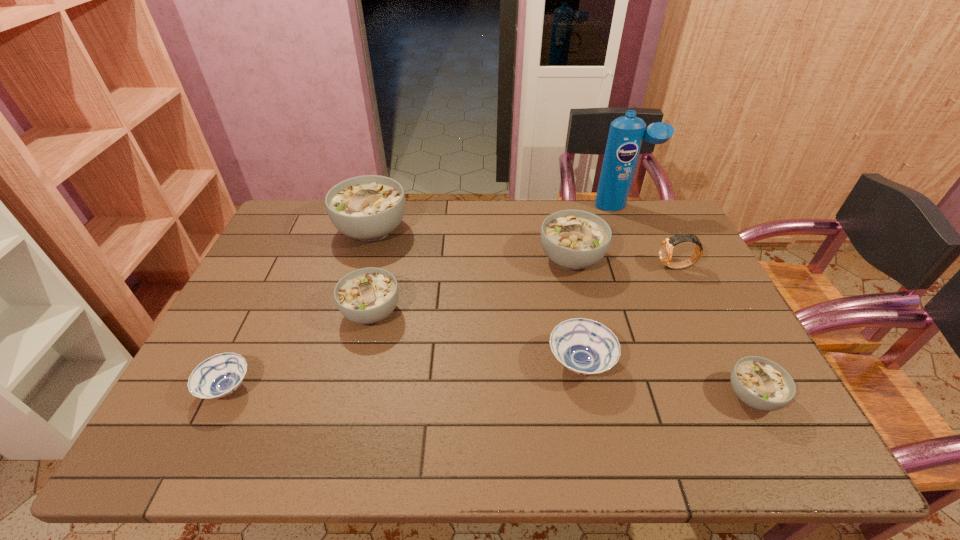
Where is `free region located 0.130m on the front of the bigger blue soup bowl`? free region located 0.130m on the front of the bigger blue soup bowl is located at coordinates (597, 446).

Find the location of a particular element. vacant region located on the back of the nearest white soup bowl is located at coordinates pyautogui.click(x=706, y=305).

The image size is (960, 540). In order to click on vacant space positioned on the back of the smaller blue soup bowl in this screenshot , I will do `click(278, 283)`.

Find the location of a particular element. shampoo that is at the far edge is located at coordinates (626, 133).

The image size is (960, 540). Identify the location of object located at the left edge. (220, 375).

Find the location of a particular element. Image resolution: width=960 pixels, height=540 pixels. shampoo located in the right edge section of the desktop is located at coordinates (626, 133).

You are a GUI agent. You are given a task and a screenshot of the screen. Output one action in this format:
    pyautogui.click(x=<x>, y=<y>)
    Task: Click on the watch at the right edge
    This screenshot has height=540, width=960.
    Given the screenshot: What is the action you would take?
    pyautogui.click(x=666, y=247)

Find the location of a particular element. Image resolution: width=960 pixels, height=540 pixels. soup bowl at the right edge is located at coordinates (760, 383).

Image resolution: width=960 pixels, height=540 pixels. I want to click on object present at the far right corner, so click(626, 133).

Find the location of a particular element. vacant area at the far edge is located at coordinates (426, 227).